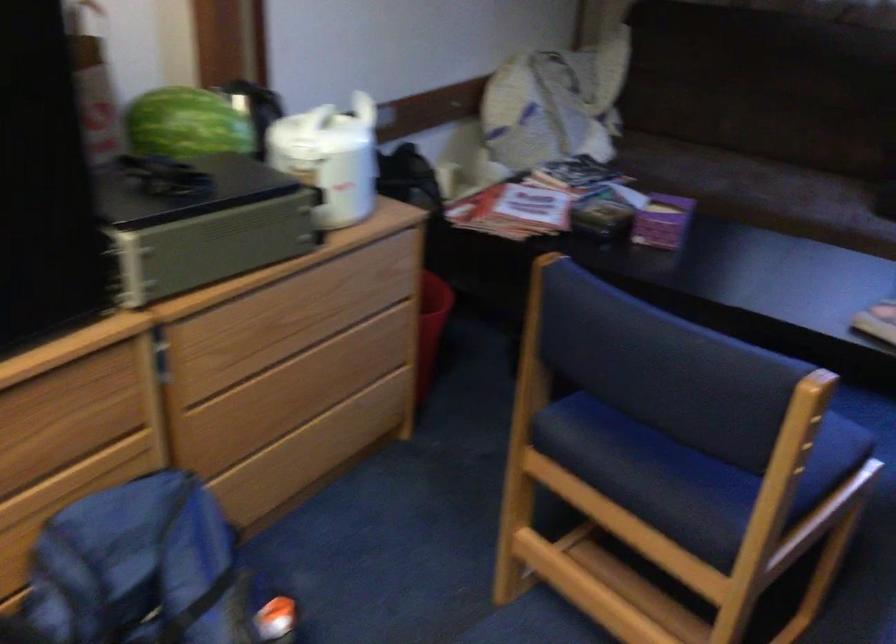
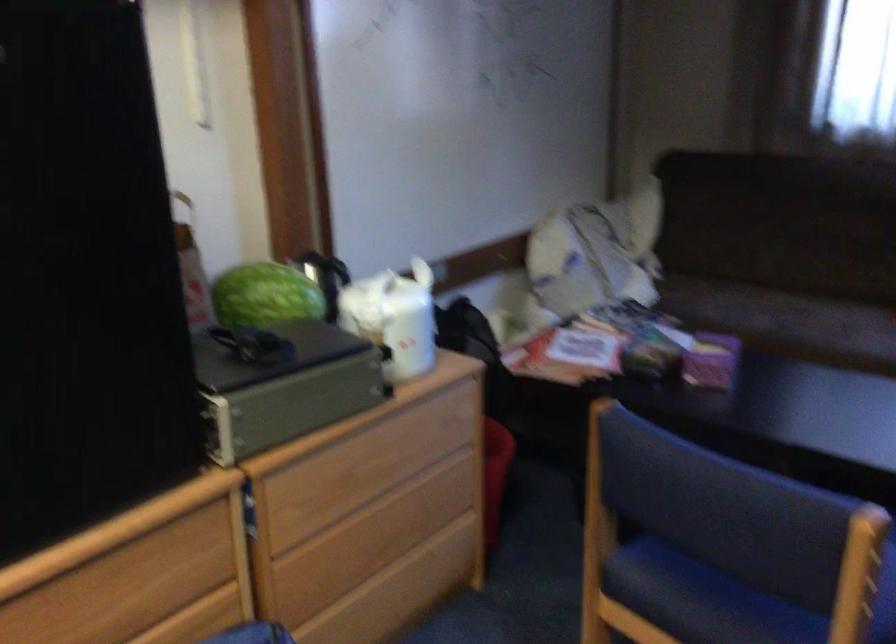
Locate, in the second image, the point that corresponds to [365,104] in the first image.

(426, 270)